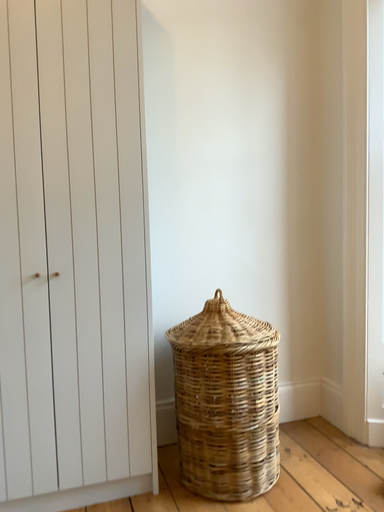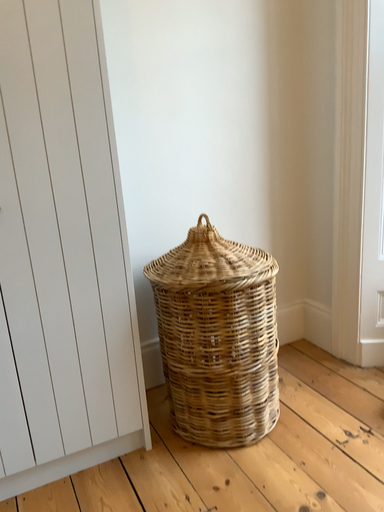
Question: Which way did the camera rotate in the video?

Choices:
 (A) rotated downward
 (B) rotated upward

Answer: (A)